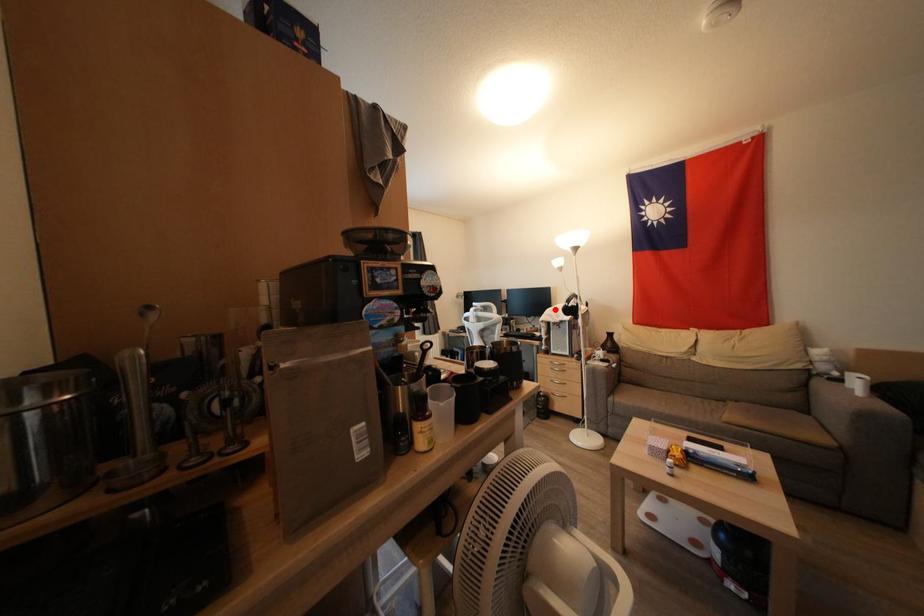
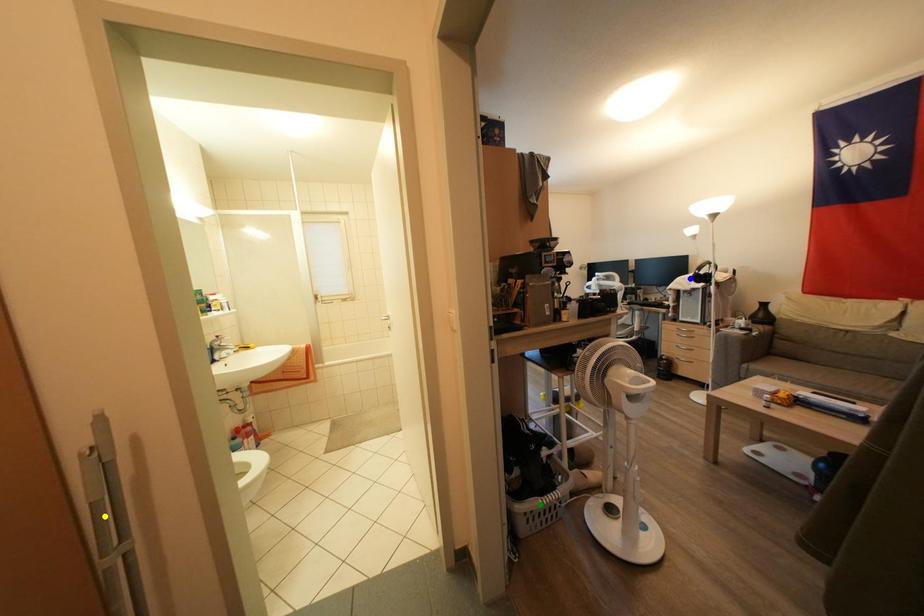
Question: I am providing you with two images of the same scene from different viewpoints. A red point is marked on the first image. You are given multiple points on the second image. Which point in image 2 represents the same 3d spot as the red point in image 1?

Choices:
 (A) green point
 (B) blue point
 (C) yellow point

Answer: (B)